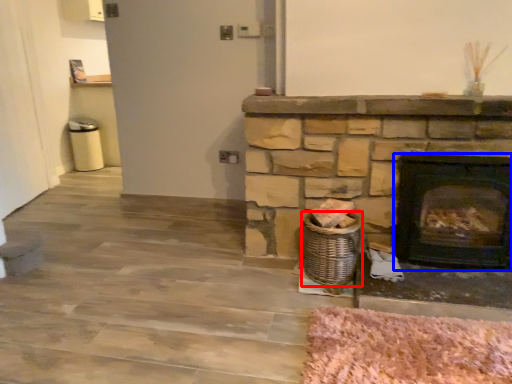
Question: Which of the following is the farthest to the observer, basket (highlighted by a red box) or wood burning stove (highlighted by a blue box)?

Choices:
 (A) basket
 (B) wood burning stove

Answer: (A)